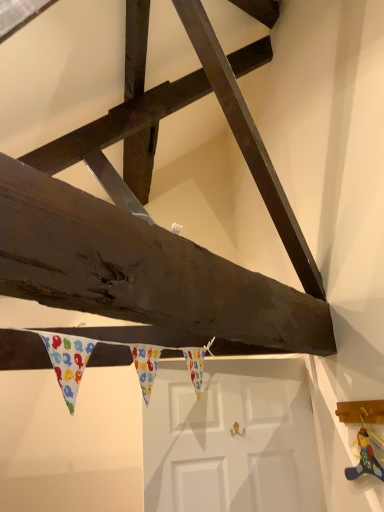
Question: In terms of width, does white matte door at center look wider or thinner when compared to wooden toy at lower right?

Choices:
 (A) thin
 (B) wide

Answer: (B)

Question: Is point (183, 406) closer or farther from the camera than point (362, 473)?

Choices:
 (A) farther
 (B) closer

Answer: (A)

Question: Considering the positions of white matte door at center and wooden toy at lower right in the image, is white matte door at center taller or shorter than wooden toy at lower right?

Choices:
 (A) tall
 (B) short

Answer: (A)

Question: From a real-world perspective, is wooden toy at lower right physically located above or below white matte door at center?

Choices:
 (A) below
 (B) above

Answer: (B)

Question: Considering the relative positions of wooden toy at lower right and white matte door at center in the image provided, is wooden toy at lower right to the left or to the right of white matte door at center?

Choices:
 (A) left
 (B) right

Answer: (B)

Question: Considering the positions of wooden toy at lower right and white matte door at center in the image, is wooden toy at lower right wider or thinner than white matte door at center?

Choices:
 (A) wide
 (B) thin

Answer: (B)

Question: Does point tap(364, 430) appear closer or farther from the camera than point tap(182, 462)?

Choices:
 (A) closer
 (B) farther

Answer: (A)